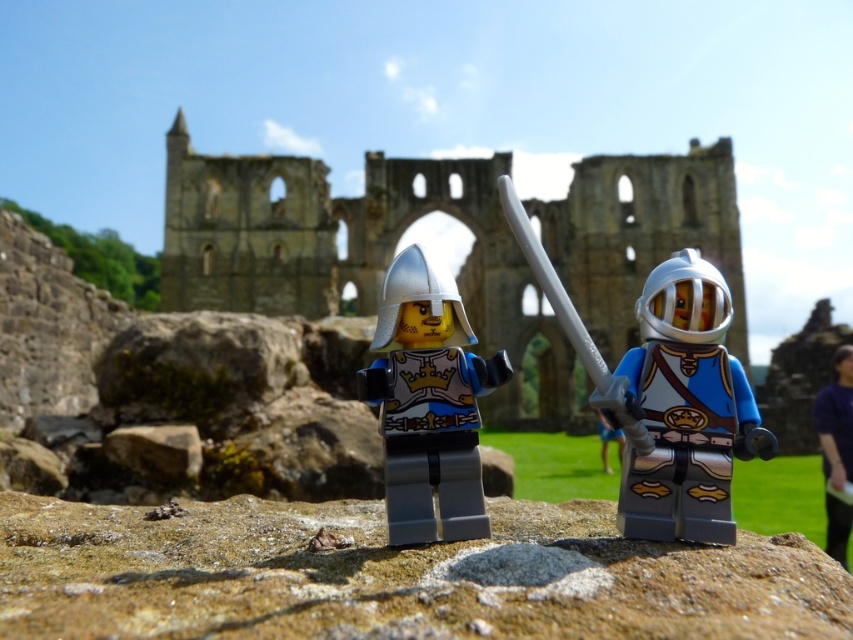
Consider the image. Does shiny silver helmet at center appear under blue fabric pants at center?

Actually, shiny silver helmet at center is above blue fabric pants at center.

Describe the element at coordinates (664, 394) in the screenshot. I see `shiny silver helmet at center` at that location.

Describe the element at coordinates (664, 394) in the screenshot. I see `shiny silver helmet at center` at that location.

Identify the location of shiny silver helmet at center. (664, 394).

Between stone ruins at center and blue fabric pants at center, which one appears on the left side from the viewer's perspective?

stone ruins at center

Find the location of a particular element. The width and height of the screenshot is (853, 640). stone ruins at center is located at coordinates (354, 252).

Who is lower down, stone ruins at center or purple fabric at lower right?

Positioned lower is purple fabric at lower right.

The image size is (853, 640). What do you see at coordinates (354, 252) in the screenshot? I see `stone ruins at center` at bounding box center [354, 252].

Find the location of `stone ruins at center`. stone ruins at center is located at coordinates (354, 252).